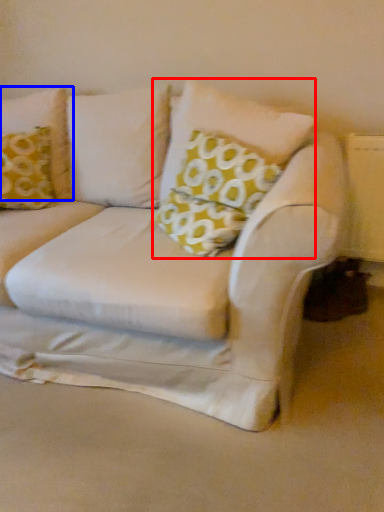
Question: Which of the following is the closest to the observer, pillow (highlighted by a red box) or pillow (highlighted by a blue box)?

Choices:
 (A) pillow
 (B) pillow

Answer: (A)